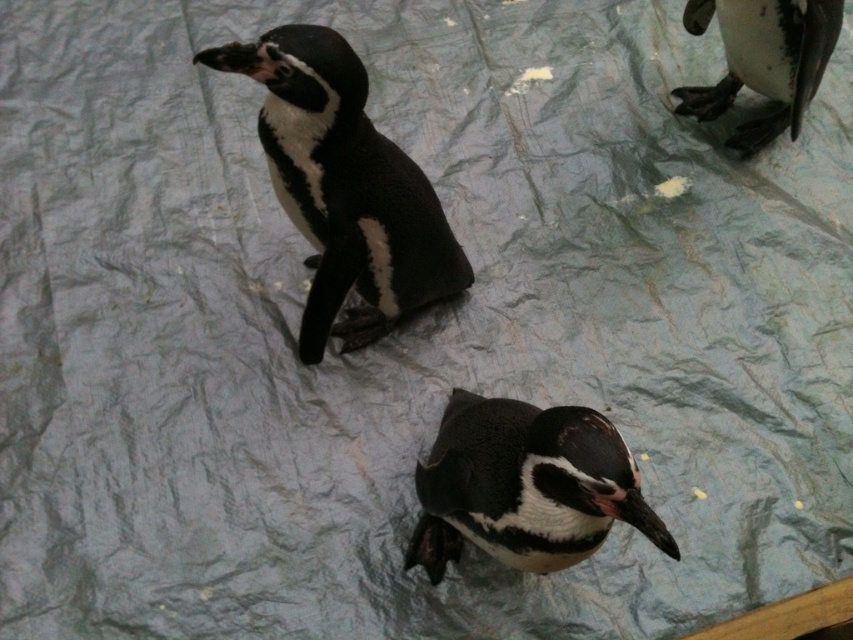
Question: Is black matte penguin at center above black glossy penguin at upper right?

Choices:
 (A) yes
 (B) no

Answer: (B)

Question: Can you confirm if black matte penguin at upper center is smaller than black matte penguin at center?

Choices:
 (A) yes
 (B) no

Answer: (B)

Question: Is black matte penguin at center below black glossy penguin at upper right?

Choices:
 (A) yes
 (B) no

Answer: (A)

Question: Which point is farther to the camera?

Choices:
 (A) (693, 4)
 (B) (496, 508)
 (C) (404, 253)

Answer: (A)

Question: Among these objects, which one is farthest from the camera?

Choices:
 (A) black matte penguin at center
 (B) black matte penguin at upper center
 (C) black glossy penguin at upper right

Answer: (C)

Question: Considering the real-world distances, which object is farthest from the black matte penguin at center?

Choices:
 (A) black matte penguin at upper center
 (B) black glossy penguin at upper right

Answer: (B)